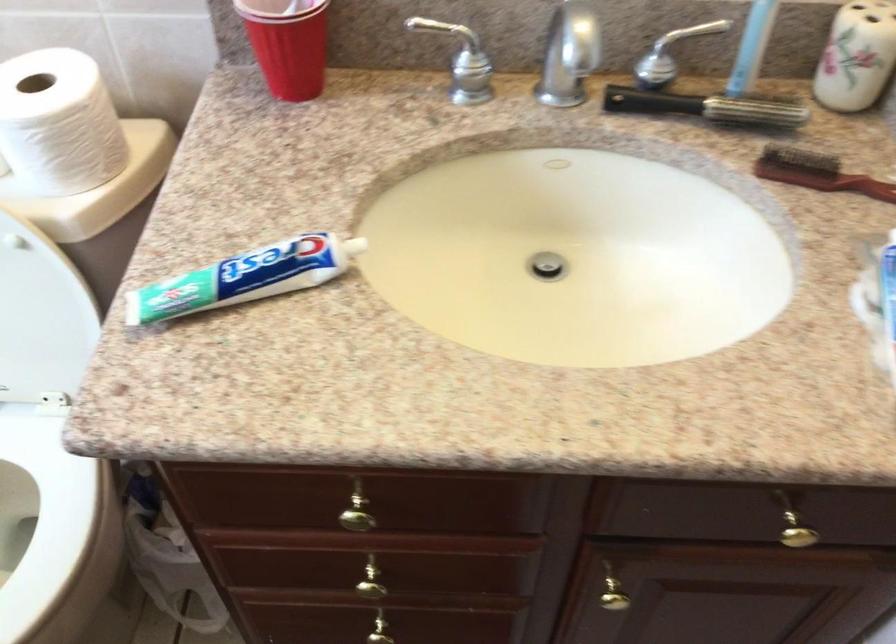
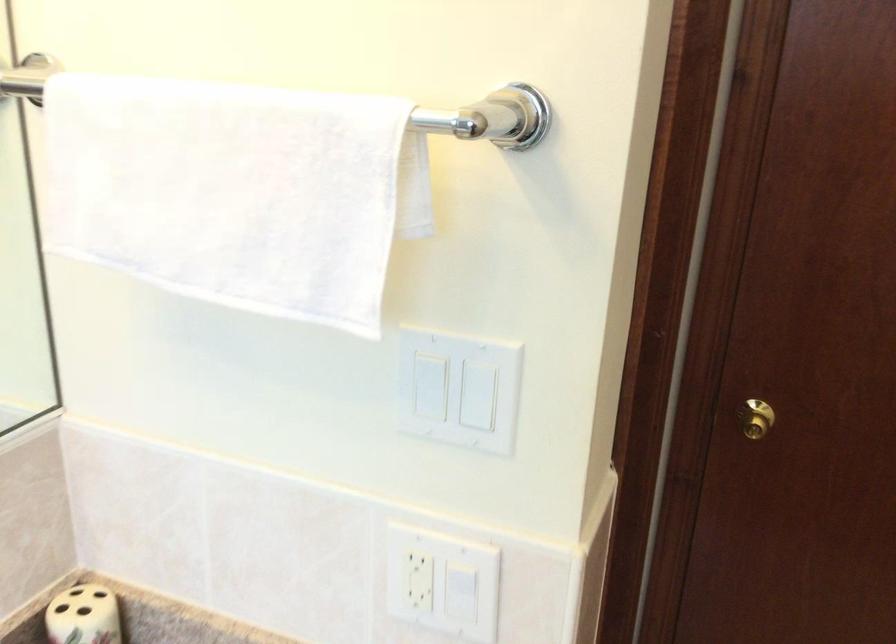
Question: Based on the continuous images, in which direction is the camera rotating? Reply with the corresponding letter.

Choices:
 (A) Left
 (B) Right
 (C) Up
 (D) Down

Answer: (B)